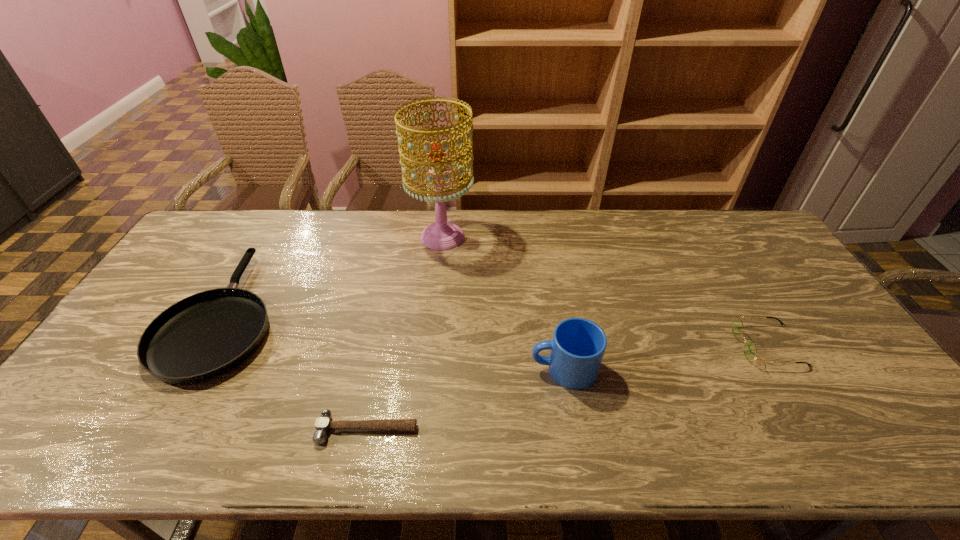
This screenshot has width=960, height=540. Identify the location of free space between the nearest object and the leftmost object. (296, 372).

Where is `vacant region between the second object from right to left and the spectacles`? vacant region between the second object from right to left and the spectacles is located at coordinates (665, 357).

Find the location of a particular element. vacant space that's between the mug and the leftmost object is located at coordinates (395, 341).

Image resolution: width=960 pixels, height=540 pixels. Find the location of `empty space between the hammer and the frying pan`. empty space between the hammer and the frying pan is located at coordinates (296, 372).

Identify the location of empty location between the lampshade and the shortest object. The height and width of the screenshot is (540, 960). (405, 333).

Locate an element on the screen. Image resolution: width=960 pixels, height=540 pixels. free point between the lampshade and the second tallest object is located at coordinates (503, 303).

At what (x,y) coordinates should I click in order to perform the action: click on object identified as the fourth closest to the lampshade. Please return your answer as a coordinate pair (x, y). Looking at the image, I should click on (750, 351).

Select which object appears as the fourth closest to the frying pan. Please provide its 2D coordinates. Your answer should be formatted as a tuple, i.e. [(x, y)], where the tuple contains the x and y coordinates of a point satisfying the conditions above.

[(750, 351)]

What are the coordinates of `vacant position in the image that satisfies the following two spatial constraints: 1. on the lenses of the spectacles; 2. on the striking face of the nearest object` in the screenshot? It's located at click(x=818, y=429).

What are the coordinates of `free point that satisfies the following two spatial constraints: 1. on the handle side of the tallest object; 2. on the left side of the leftmost object` in the screenshot? It's located at (269, 237).